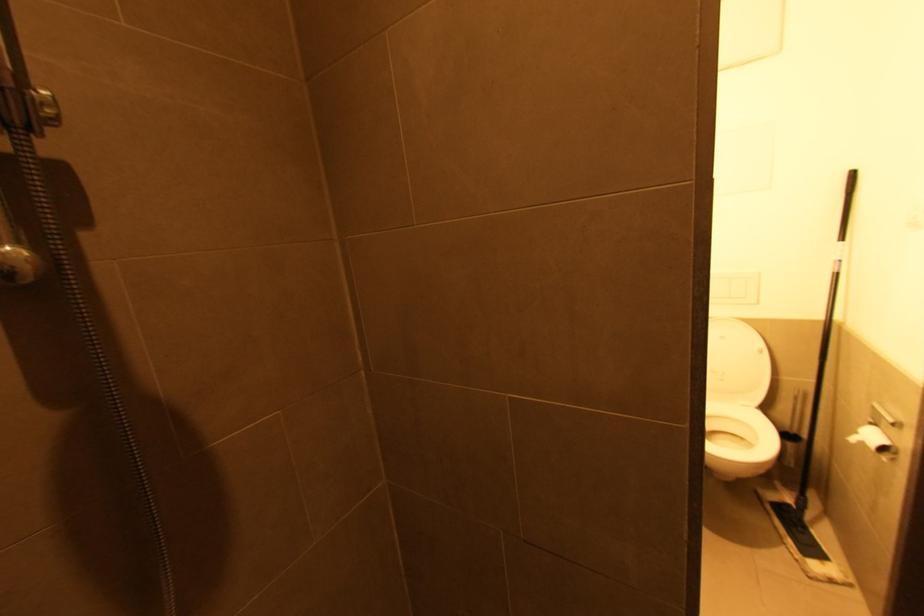
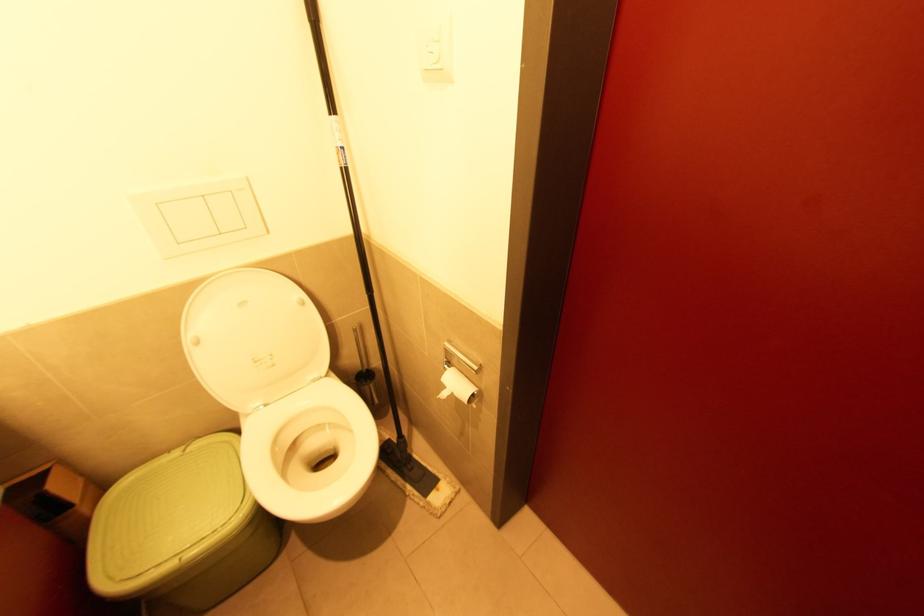
Where in the second image is the point corresponding to (x=839, y=277) from the first image?

(347, 172)